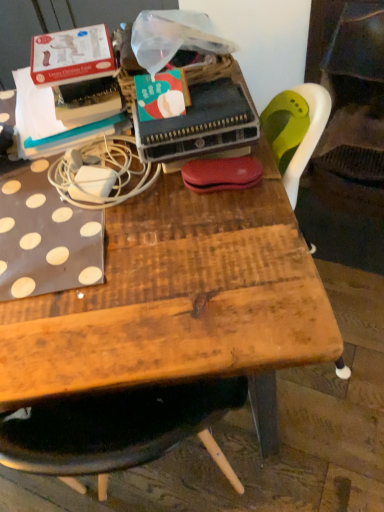
Question: Is white matte power adapter at upper left surrounded by wooden table at center?

Choices:
 (A) yes
 (B) no

Answer: (B)

Question: Does wooden table at center have a larger size compared to white matte power adapter at upper left?

Choices:
 (A) yes
 (B) no

Answer: (A)

Question: Can you confirm if wooden table at center is positioned to the left of white matte power adapter at upper left?

Choices:
 (A) no
 (B) yes

Answer: (A)

Question: Is the depth of wooden table at center less than that of white matte power adapter at upper left?

Choices:
 (A) yes
 (B) no

Answer: (B)

Question: Does wooden table at center have a lesser width compared to white matte power adapter at upper left?

Choices:
 (A) no
 (B) yes

Answer: (A)

Question: Is wooden table at center in front of or behind matte green paperback book at center in the image?

Choices:
 (A) front
 (B) behind

Answer: (B)

Question: From the image's perspective, is wooden table at center located above or below matte green paperback book at center?

Choices:
 (A) below
 (B) above

Answer: (A)

Question: In terms of size, does wooden table at center appear bigger or smaller than matte green paperback book at center?

Choices:
 (A) small
 (B) big

Answer: (B)

Question: From a real-world perspective, is wooden table at center positioned above or below matte green paperback book at center?

Choices:
 (A) above
 (B) below

Answer: (B)

Question: Choose the correct answer: Is white matte power adapter at upper left inside matte green paperback book at center or outside it?

Choices:
 (A) inside
 (B) outside

Answer: (B)

Question: In terms of width, does white matte power adapter at upper left look wider or thinner when compared to matte green paperback book at center?

Choices:
 (A) wide
 (B) thin

Answer: (A)

Question: Is point (117, 189) closer or farther from the camera than point (210, 113)?

Choices:
 (A) farther
 (B) closer

Answer: (A)

Question: Is white matte power adapter at upper left in front of or behind matte green paperback book at center in the image?

Choices:
 (A) behind
 (B) front

Answer: (A)

Question: Looking at their shapes, would you say white matte power adapter at upper left is wider or thinner than wooden table at center?

Choices:
 (A) wide
 (B) thin

Answer: (B)

Question: From their relative heights in the image, would you say white matte power adapter at upper left is taller or shorter than wooden table at center?

Choices:
 (A) tall
 (B) short

Answer: (B)